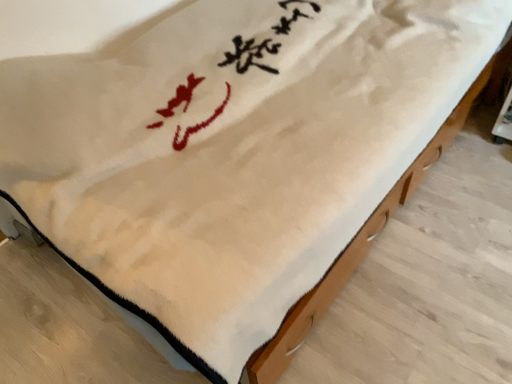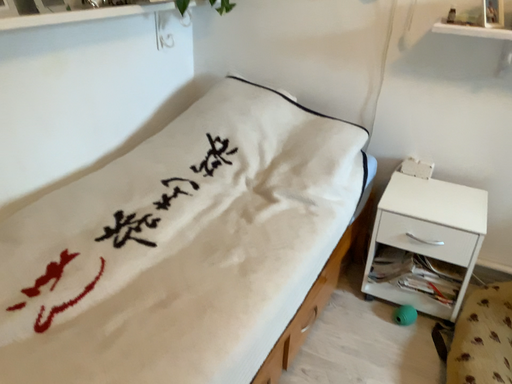
Question: Which way did the camera rotate in the video?

Choices:
 (A) rotated left
 (B) rotated right

Answer: (B)